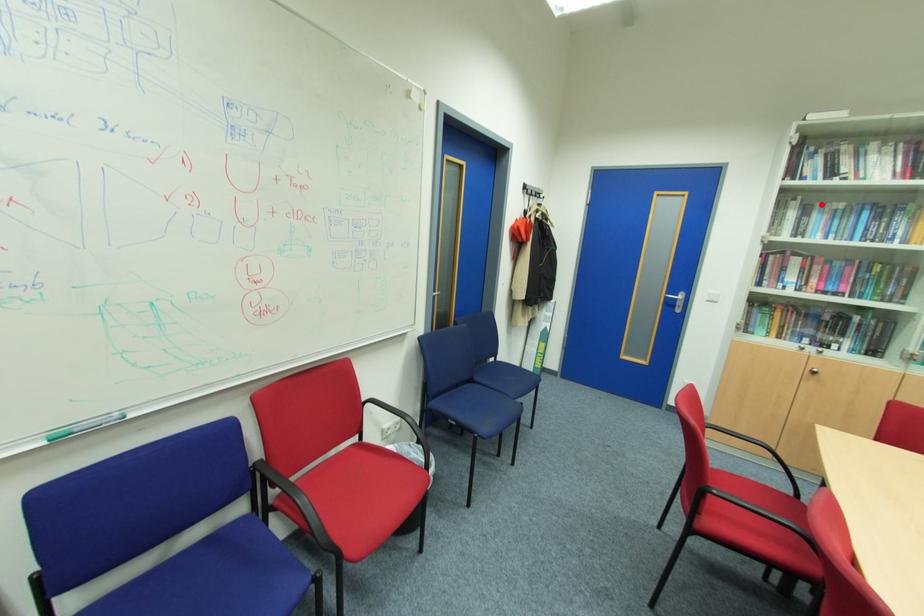
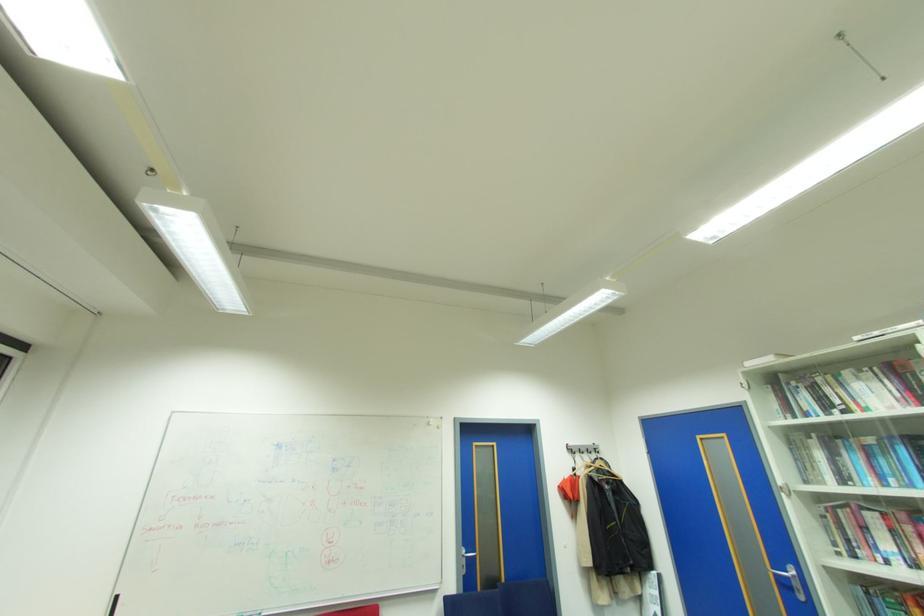
Question: A red point is marked in image1. In image2, is the corresponding 3D point closer to the camera or farther? Reply with the corresponding letter.

Choices:
 (A) The corresponding 3D point is closer.
 (B) The corresponding 3D point is farther.

Answer: (A)